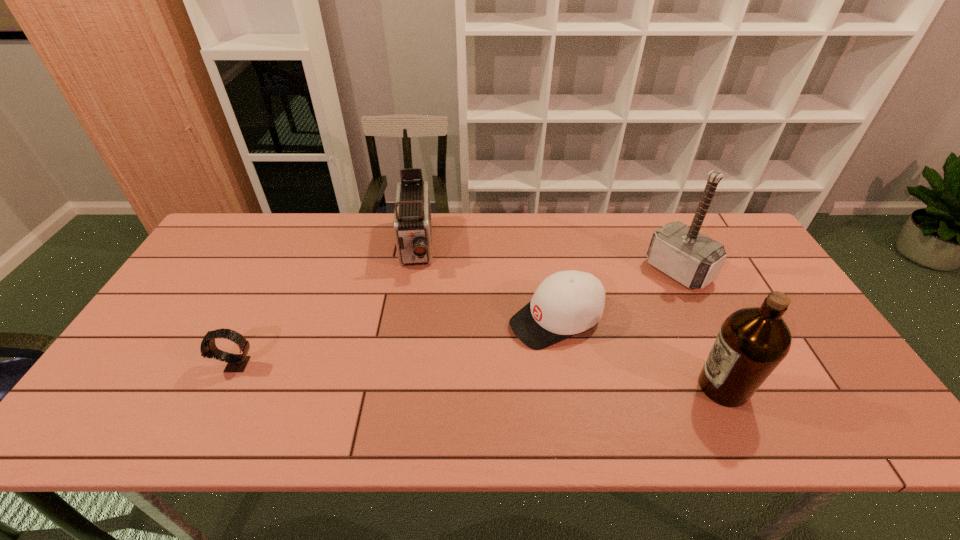
Image resolution: width=960 pixels, height=540 pixels. Find the location of `vacant point that satisfies the following two spatial constraints: 1. on the front side of the third tallest object; 2. on the right side of the hammer`. vacant point that satisfies the following two spatial constraints: 1. on the front side of the third tallest object; 2. on the right side of the hammer is located at coordinates (412, 271).